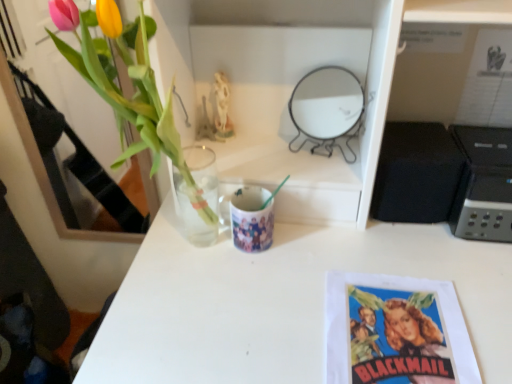
The image size is (512, 384). What do you see at coordinates (483, 184) in the screenshot? I see `black plastic printer at right` at bounding box center [483, 184].

This screenshot has width=512, height=384. I want to click on black plastic printer at right, so click(483, 184).

You are a GUI agent. You are given a task and a screenshot of the screen. Output one action in this format:
    pyautogui.click(x=<x>, y=<y>)
    Task: Click on the mirror above the printed paper poster at lower right (from a real-world perspective)
    Image resolution: width=512 pixels, height=384 pixels.
    Given the screenshot: What is the action you would take?
    pyautogui.click(x=327, y=103)

How different are the orientations of metallic round mirror at upper center and printed paper poster at lower right in degrees?

They differ by 0.0557 degrees in their facing directions.

Which of these two, metallic round mirror at upper center or printed paper poster at lower right, is bigger?

With larger size is metallic round mirror at upper center.

Considering the relative sizes of metallic round mirror at upper center and printed paper poster at lower right in the image provided, is metallic round mirror at upper center shorter than printed paper poster at lower right?

No.

Is black plastic printer at right oriented away from matte ceramic mug at center?

No.

Considering the positions of points (495, 234) and (248, 215), is point (495, 234) closer to camera compared to point (248, 215)?

No.

From the image's perspective, does black plastic printer at right appear higher than matte ceramic mug at center?

Yes, from the image's perspective, black plastic printer at right is above matte ceramic mug at center.

Does black plastic printer at right come in front of matte ceramic mug at center?

Yes, it is in front of matte ceramic mug at center.

Is black plastic printer at right thinner than printed paper poster at lower right?

Yes.

Is black plastic printer at right next to printed paper poster at lower right and touching it?

black plastic printer at right and printed paper poster at lower right are clearly separated.

Is black plastic printer at right in front of or behind printed paper poster at lower right in the image?

black plastic printer at right is positioned farther from the viewer than printed paper poster at lower right.

Does black plastic printer at right contain printed paper poster at lower right?

That's incorrect, printed paper poster at lower right is not inside black plastic printer at right.

In the scene shown: Is black matte speaker at right positioned with its back to metallic round mirror at upper center?

No, black matte speaker at right is not facing the opposite direction of metallic round mirror at upper center.

Which of these two, black matte speaker at right or metallic round mirror at upper center, stands shorter?

Standing shorter between the two is metallic round mirror at upper center.

Find the location of a particular element. This screenshot has width=512, height=384. speaker in front of the metallic round mirror at upper center is located at coordinates (416, 173).

Based on the photo, does black matte speaker at right come behind metallic round mirror at upper center?

No, it is in front of metallic round mirror at upper center.

Based on the photo, is translucent glass vase at upper left touching matte ceramic mug at center?

No, translucent glass vase at upper left is not beside matte ceramic mug at center.

Considering the sizes of translucent glass vase at upper left and matte ceramic mug at center in the image, is translucent glass vase at upper left wider or thinner than matte ceramic mug at center?

Clearly, translucent glass vase at upper left has more width compared to matte ceramic mug at center.

In terms of height, does translucent glass vase at upper left look taller or shorter compared to matte ceramic mug at center?

translucent glass vase at upper left is taller than matte ceramic mug at center.

From the image's perspective, would you say translucent glass vase at upper left is shown under matte ceramic mug at center?

No, from the image's perspective, translucent glass vase at upper left is not beneath matte ceramic mug at center.

Considering their positions, is printed paper poster at lower right located in front of or behind metallic round mirror at upper center?

printed paper poster at lower right is in front of metallic round mirror at upper center.

Is point (458, 321) positioned before point (348, 76)?

Yes, it is in front of point (348, 76).

Based on the photo, who is bigger, printed paper poster at lower right or metallic round mirror at upper center?

metallic round mirror at upper center.

Is printed paper poster at lower right facing towards metallic round mirror at upper center?

No, printed paper poster at lower right is not facing towards metallic round mirror at upper center.

Who is shorter, printed paper poster at lower right or matte ceramic mug at center?

printed paper poster at lower right.

This screenshot has width=512, height=384. Identify the location of book cover to the right of matte ceramic mug at center. (395, 331).

Is matte ceramic mug at center completely or partially inside printed paper poster at lower right?

No.

Which object is positioned more to the left, printed paper poster at lower right or matte ceramic mug at center?

matte ceramic mug at center.

The image size is (512, 384). Identify the location of book cover below the metallic round mirror at upper center (from the image's perspective). (395, 331).

Image resolution: width=512 pixels, height=384 pixels. In order to click on mug behind the black plastic printer at right in this screenshot , I will do `click(252, 219)`.

Estimate the real-world distances between objects in this image. Which object is further from matte ceramic mug at center, metallic round mirror at upper center or translucent glass vase at upper left?

metallic round mirror at upper center is further to matte ceramic mug at center.

Looking at the image, which one is located further to matte ceramic mug at center, translucent glass vase at upper left or black plastic printer at right?

black plastic printer at right lies further to matte ceramic mug at center than the other object.

Estimate the real-world distances between objects in this image. Which object is closer to translucent glass vase at upper left, black matte speaker at right or metallic round mirror at upper center?

The object closer to translucent glass vase at upper left is metallic round mirror at upper center.

From the picture: Based on their spatial positions, is black matte speaker at right or black plastic printer at right closer to printed paper poster at lower right?

black matte speaker at right is closer to printed paper poster at lower right.

When comparing their distances from matte ceramic mug at center, does black plastic printer at right or metallic round mirror at upper center seem closer?

metallic round mirror at upper center lies closer to matte ceramic mug at center than the other object.

Based on their spatial positions, is translucent glass vase at upper left or metallic round mirror at upper center further from matte ceramic mug at center?

The object further to matte ceramic mug at center is metallic round mirror at upper center.

When comparing their distances from matte ceramic mug at center, does black matte speaker at right or black plastic printer at right seem further?

Based on the image, black plastic printer at right appears to be further to matte ceramic mug at center.

Considering their positions, is metallic round mirror at upper center positioned further to printed paper poster at lower right than translucent glass vase at upper left?

metallic round mirror at upper center lies further to printed paper poster at lower right than the other object.

Image resolution: width=512 pixels, height=384 pixels. In order to click on mirror between translucent glass vase at upper left and printed paper poster at lower right in the horizontal direction in this screenshot , I will do `click(327, 103)`.

Where is `appliance between black matte speaker at right and printed paper poster at lower right vertically`? appliance between black matte speaker at right and printed paper poster at lower right vertically is located at coordinates (483, 184).

Locate an element on the screen. Image resolution: width=512 pixels, height=384 pixels. book cover between translucent glass vase at upper left and black matte speaker at right in the horizontal direction is located at coordinates (395, 331).

Identify the location of book cover between translucent glass vase at upper left and black plastic printer at right. This screenshot has height=384, width=512. (395, 331).